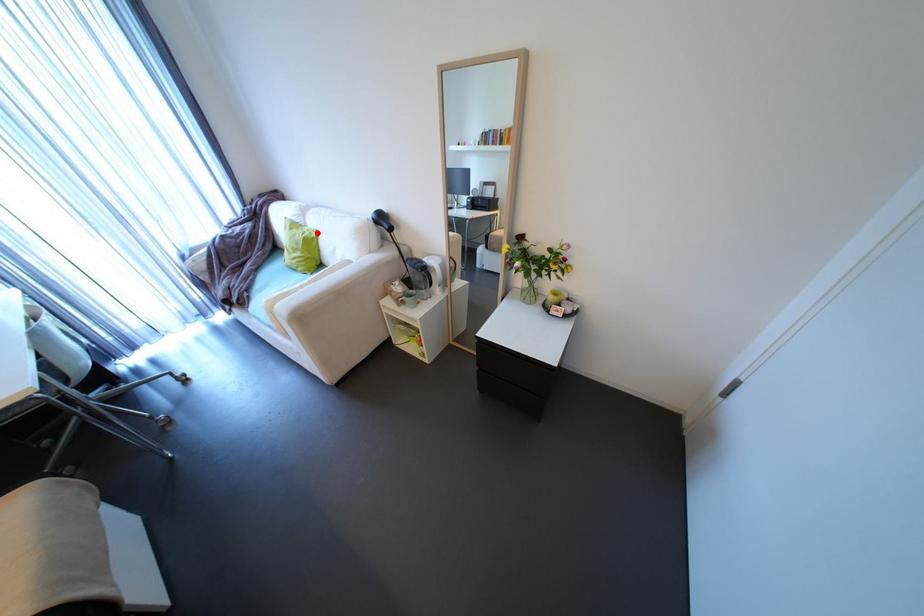
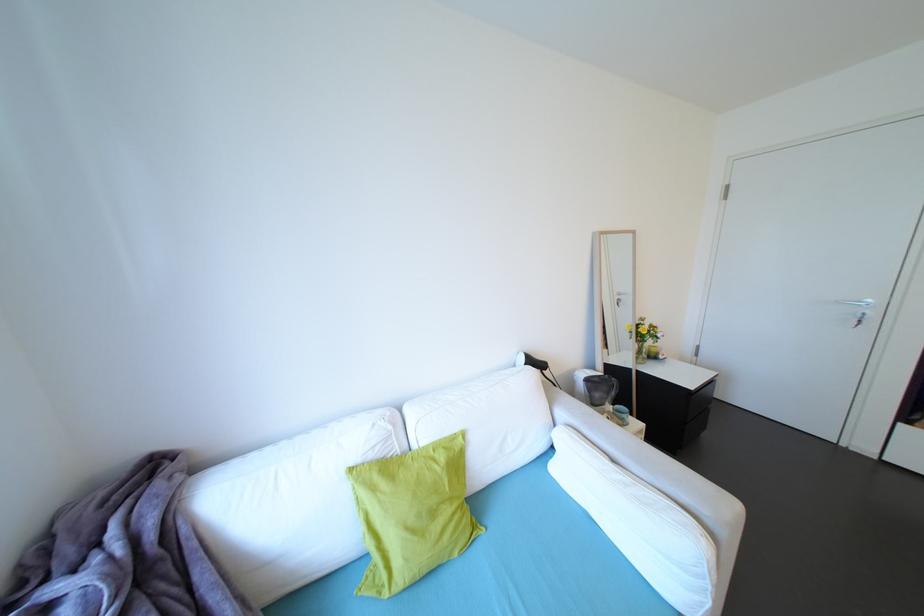
Question: I am providing you with two images of the same scene from different viewpoints. Image1 has a red point marked. In image2, the corresponding 3D location appears at what relative position? Reply with the corresponding letter.

Choices:
 (A) Closer
 (B) Farther

Answer: (B)